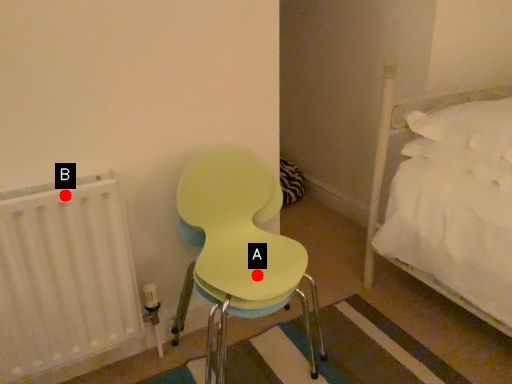
Question: Two points are circled on the image, labeled by A and B beside each circle. Which point is farther from the camera taking this photo?

Choices:
 (A) A is further
 (B) B is further

Answer: (A)